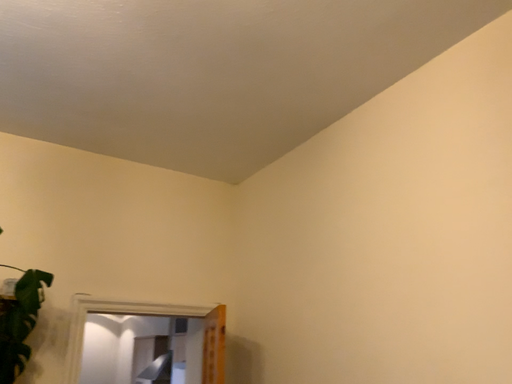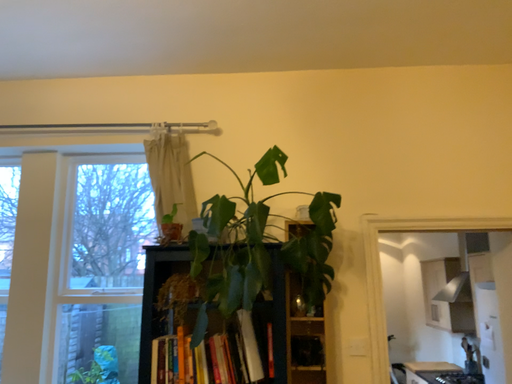
Question: How did the camera likely rotate when shooting the video?

Choices:
 (A) rotated right
 (B) rotated left

Answer: (B)